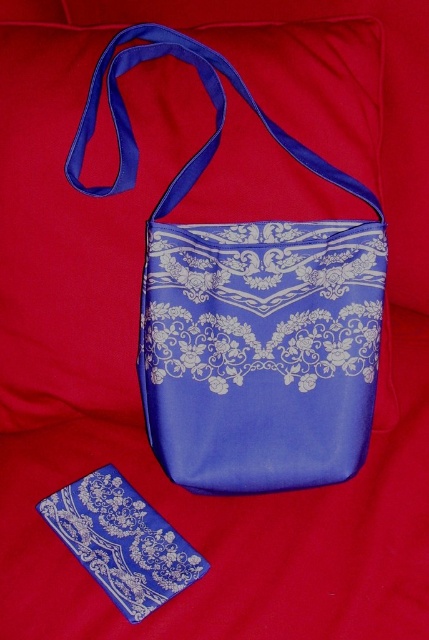
You are standing in front of a display with a blue satin wallet at center and a blue bag with white floral patterns. If you want to pick up the wallet without bending down, will you be able to reach it from your current position?

The blue satin wallet at center is 3.67 feet away from the viewer. Since this distance is within typical reaching range for an adult standing upright, you can likely reach the wallet without bending down.